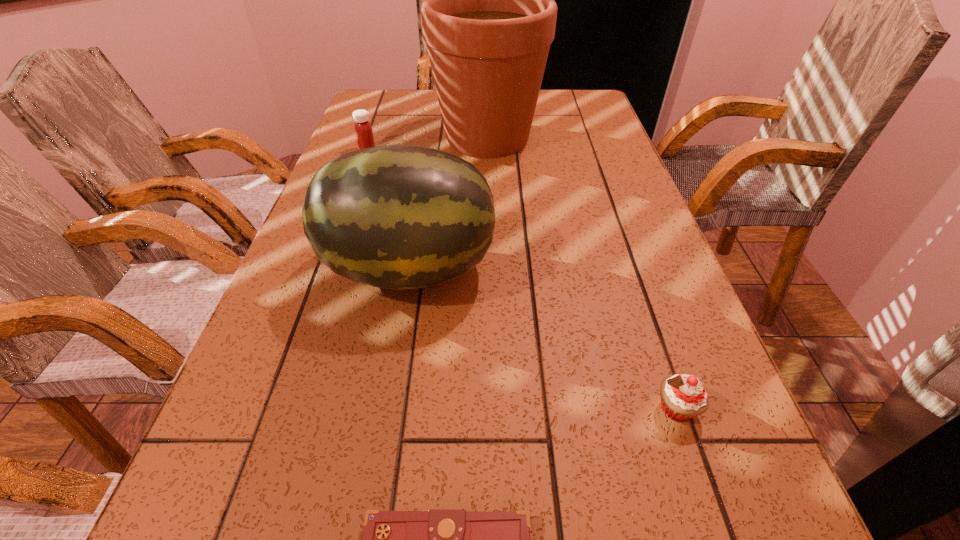
This screenshot has height=540, width=960. I want to click on the tallest object, so click(488, 13).

Identify the location of the second tallest object. This screenshot has width=960, height=540. (400, 217).

The image size is (960, 540). Find the location of `the third farthest object`. the third farthest object is located at coordinates click(x=400, y=217).

Find the location of `the third shortest object`. the third shortest object is located at coordinates (363, 130).

Where is `cupcake`? Image resolution: width=960 pixels, height=540 pixels. cupcake is located at coordinates (683, 396).

Locate an element on the screen. the fourth farthest object is located at coordinates (683, 396).

Image resolution: width=960 pixels, height=540 pixels. What are the coordinates of `vacant point located 0.340m on the front of the tallest object` in the screenshot? It's located at (491, 249).

You are a GUI agent. You are given a task and a screenshot of the screen. Output one action in this format:
    pyautogui.click(x=<x>, y=<y>)
    Task: Click on the vacant area situated 0.270m on the front of the third farthest object
    
    Given the screenshot: What is the action you would take?
    pyautogui.click(x=378, y=463)

At what (x,y) coordinates should I click in order to perform the action: click on free location located on the back of the third tallest object. Please return your answer as a coordinate pair (x, y). The width and height of the screenshot is (960, 540). Looking at the image, I should click on (376, 124).

Identify the location of vacant area situated on the left of the fourth farthest object. (540, 408).